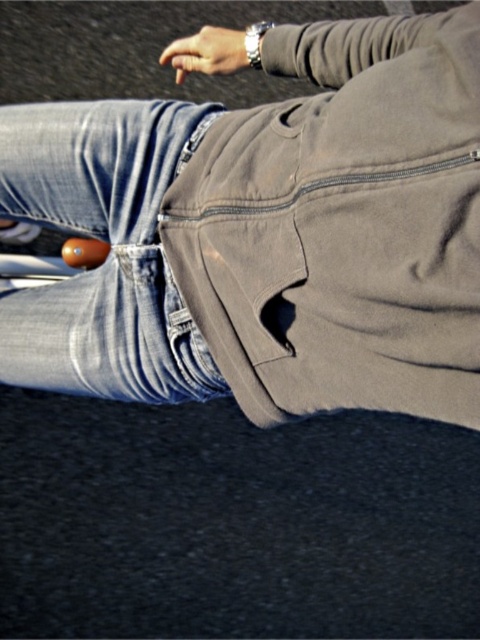
Is point (402, 396) farther from viewer compared to point (62, 134)?

No, (402, 396) is closer to viewer.

Which is behind, point (398, 93) or point (27, 193)?

Point (27, 193)

The height and width of the screenshot is (640, 480). Identify the location of matte khaki pants at center. (343, 225).

Does matte khaki pants at center lie in front of matte brown wristwatch at upper center?

That is True.

Which is in front, point (309, 76) or point (213, 74)?

Point (309, 76) is more forward.

Find the location of a particular element. matte khaki pants at center is located at coordinates (343, 225).

Is denim at center thinner than matte brown wristwatch at upper center?

No.

Is point (49, 168) positioned behind point (208, 54)?

No, (49, 168) is closer to viewer.

The image size is (480, 640). In order to click on denim at center in this screenshot , I will do `click(108, 256)`.